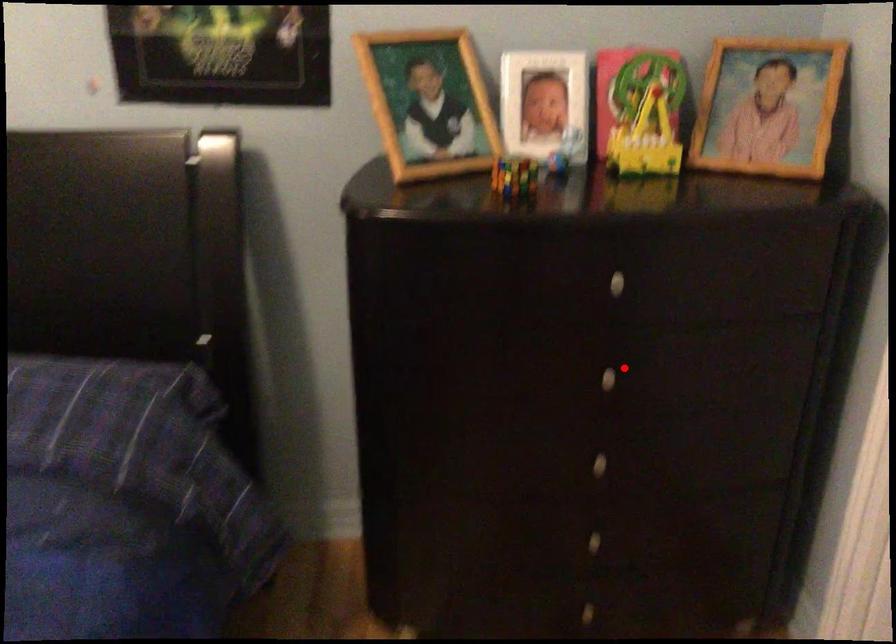
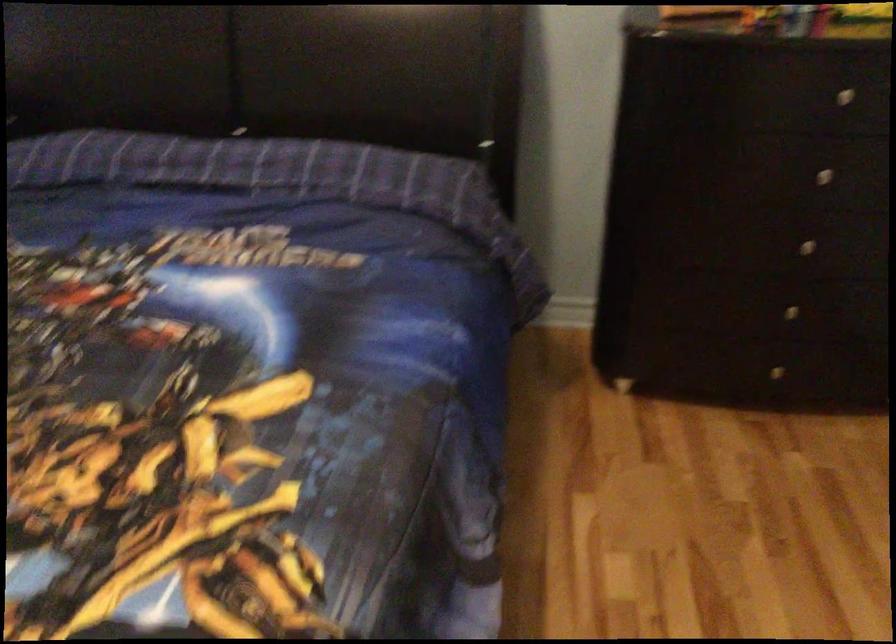
Question: I am providing you with two images of the same scene from different viewpoints. Given a red point in image1, look at the same physical point in image2. Is it:

Choices:
 (A) Closer to the viewpoint
 (B) Farther from the viewpoint

Answer: (B)